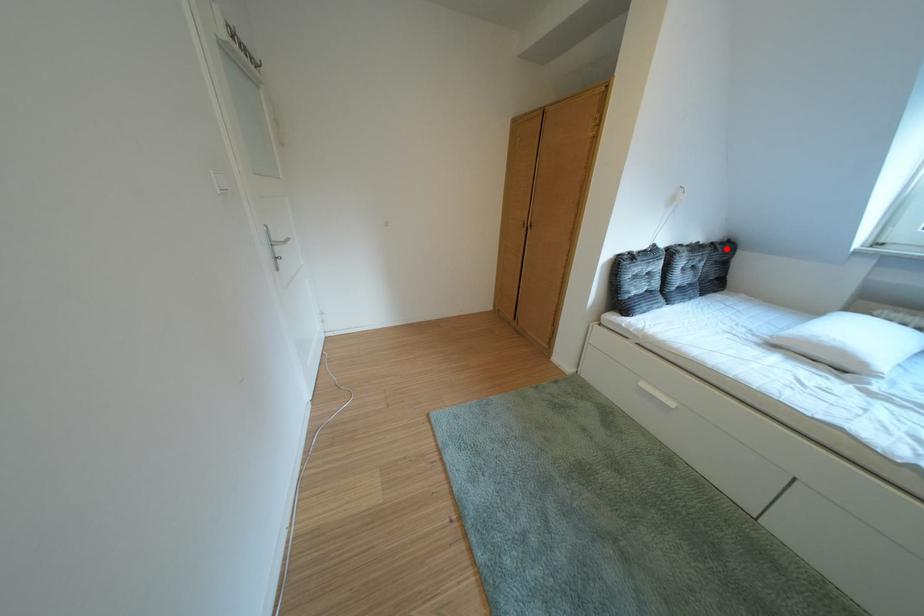
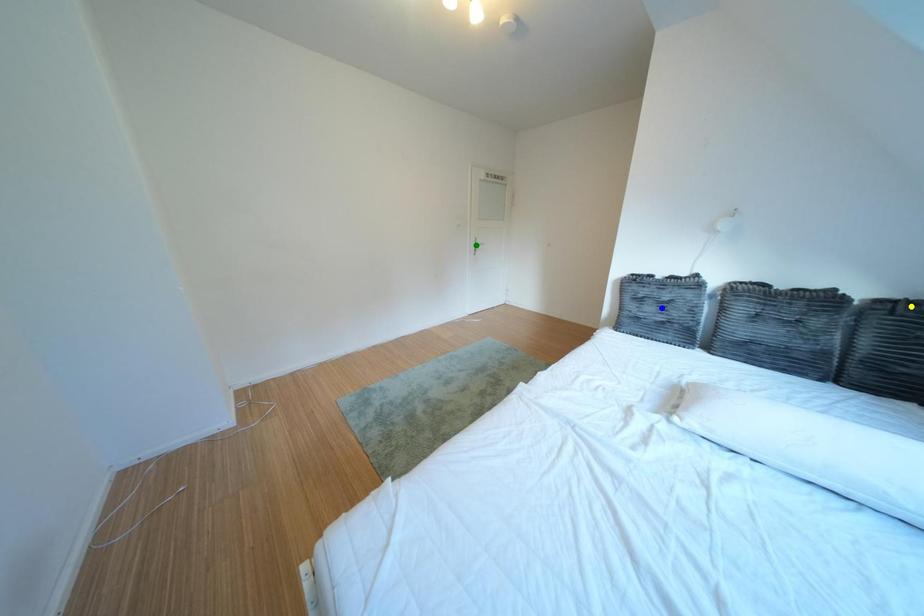
Question: I am providing you with two images of the same scene from different viewpoints. A red point is marked on the first image. You are given multiple points on the second image. Can you choose the point in image 2 that corresponds to the point in image 1?

Choices:
 (A) blue point
 (B) yellow point
 (C) green point

Answer: (B)